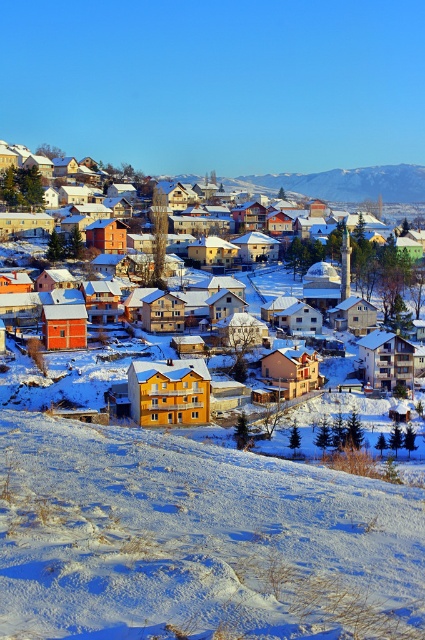
Question: Does white powdery snow at lower left lie behind yellow matte building at center?

Choices:
 (A) no
 (B) yes

Answer: (A)

Question: Which is farther from the white powdery snow at lower left?

Choices:
 (A) yellow matte building at center
 (B) snowy mountain range at upper center

Answer: (B)

Question: Does white powdery snow at lower left have a larger size compared to snowy mountain range at upper center?

Choices:
 (A) no
 (B) yes

Answer: (A)

Question: Among these points, which one is nearest to the camera?

Choices:
 (A) (189, 564)
 (B) (367, 184)
 (C) (124, 179)

Answer: (A)

Question: Which of the following is the closest to the observer?

Choices:
 (A) yellow matte building at center
 (B) snowy mountain range at upper center
 (C) white powdery snow at lower left

Answer: (C)

Question: Does white powdery snow at lower left have a larger size compared to yellow matte building at center?

Choices:
 (A) no
 (B) yes

Answer: (A)